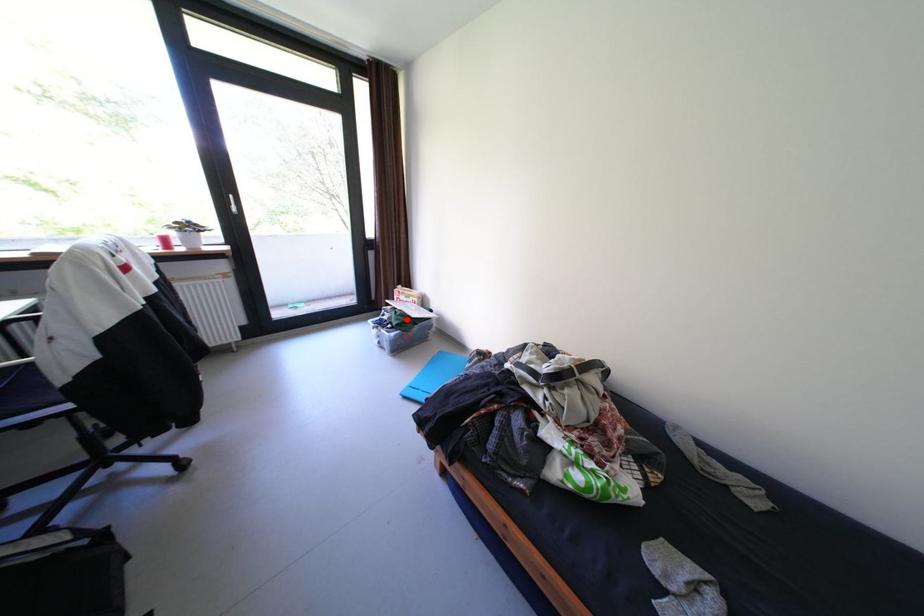
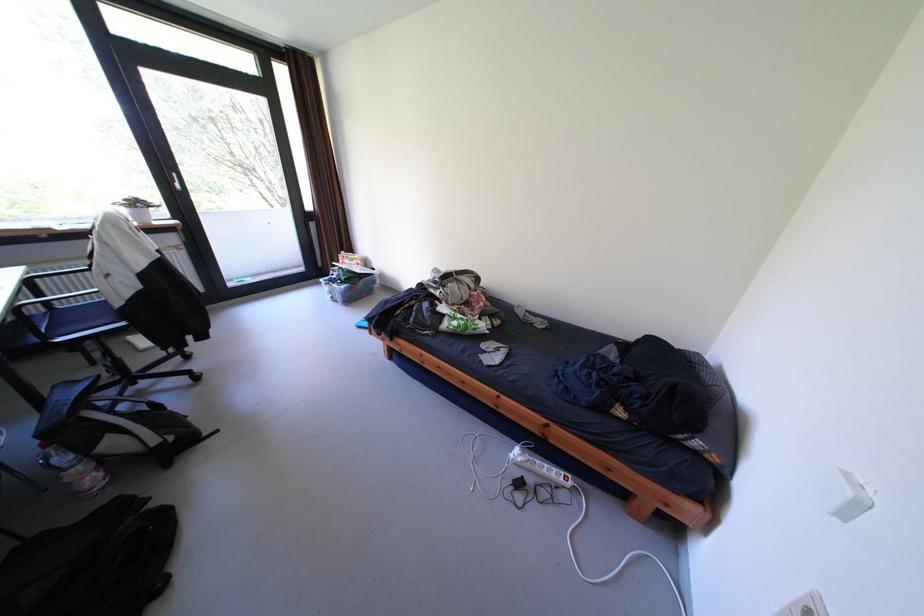
The point at the highlighted location is marked in the first image. Where is the corresponding point in the second image?

(355, 275)